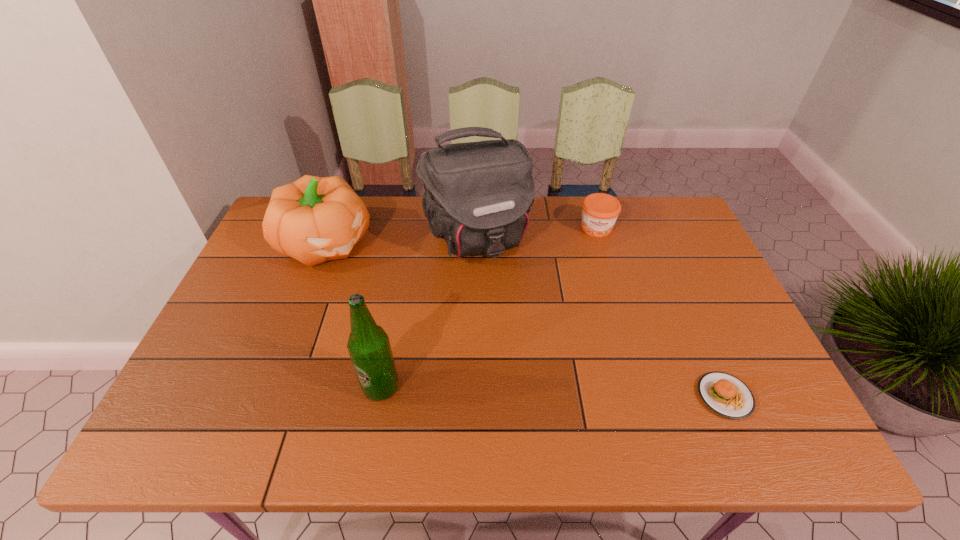
You are a GUI agent. You are given a task and a screenshot of the screen. Output one action in this format:
    pyautogui.click(x=<x>, y=<y>)
    Task: Click on the jam that is at the far edge
    Image resolution: width=960 pixels, height=540 pixels.
    Given the screenshot: What is the action you would take?
    pyautogui.click(x=600, y=211)

This screenshot has height=540, width=960. What are the coordinates of `shoulder bag that is positioned at the far edge` in the screenshot? It's located at (477, 197).

Where is `pumpkin present at the far edge`? The image size is (960, 540). pumpkin present at the far edge is located at coordinates (314, 219).

This screenshot has width=960, height=540. I want to click on beer bottle that is at the near edge, so click(368, 345).

The image size is (960, 540). I want to click on food that is at the near edge, so click(x=726, y=395).

Where is `object that is positioned at the left edge`? The height and width of the screenshot is (540, 960). object that is positioned at the left edge is located at coordinates (314, 219).

Locate an element on the screen. This screenshot has height=540, width=960. object that is at the right edge is located at coordinates (726, 395).

Identify the location of object at the far left corner. (314, 219).

Identify the location of object present at the near right corner. (726, 395).

Locate an element on the screen. vacant space at the far edge of the desktop is located at coordinates (391, 204).